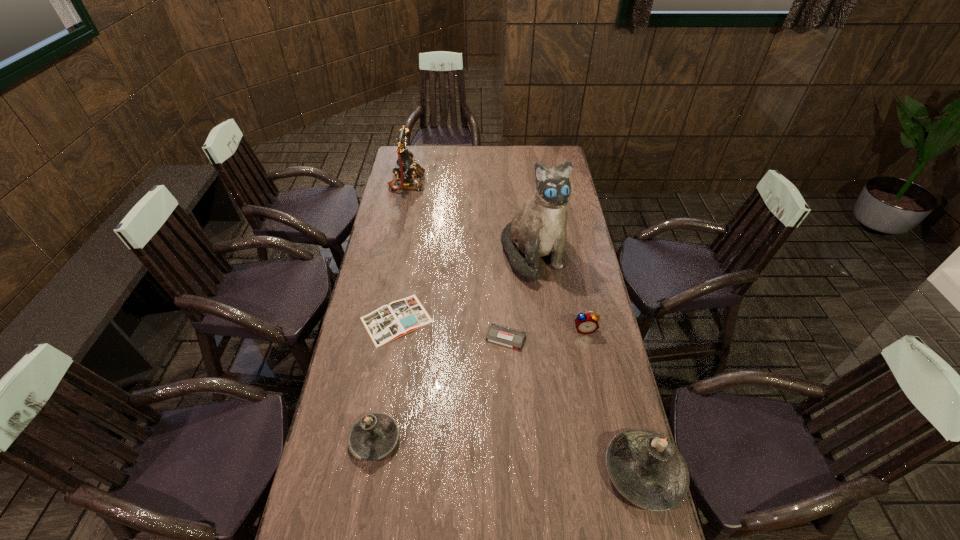
The image size is (960, 540). Find the location of `free spot between the fourth tallest object and the videotape`. free spot between the fourth tallest object and the videotape is located at coordinates (440, 388).

This screenshot has width=960, height=540. In order to click on blank region between the taller candle and the book in this screenshot , I will do click(520, 396).

Select which object appears as the fifth closest to the farthest object. Please provide its 2D coordinates. Your answer should be formatted as a tuple, i.e. [(x, y)], where the tuple contains the x and y coordinates of a point satisfying the conditions above.

[(373, 436)]

Where is `object that is the fourth closest to the alarm clock`? This screenshot has width=960, height=540. object that is the fourth closest to the alarm clock is located at coordinates (400, 317).

Locate an element on the screen. free spot that satisfies the following two spatial constraints: 1. on the front of the second tallest object, featuring the rotary dial; 2. on the back side of the book is located at coordinates (379, 320).

What are the coordinates of `free space in the image that satisfies the following two spatial constraints: 1. on the front of the telephone, featuring the rotary dial; 2. on the back side of the videotape` in the screenshot? It's located at (376, 338).

The image size is (960, 540). I want to click on free space in the image that satisfies the following two spatial constraints: 1. on the front of the sixth shortest object, featuring the rotary dial; 2. on the left side of the shorter candle, so click(x=356, y=439).

Image resolution: width=960 pixels, height=540 pixels. What are the coordinates of `vacant space that satisfies the following two spatial constraints: 1. on the front side of the third tallest object; 2. on the left side of the book` in the screenshot? It's located at (372, 471).